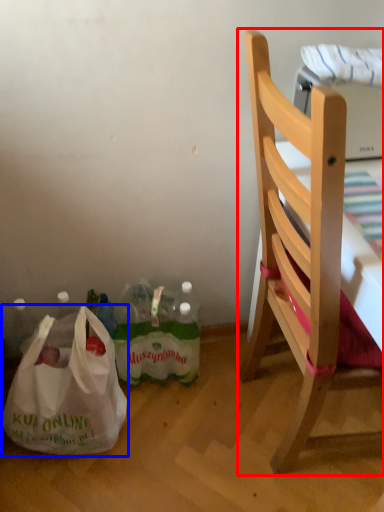
Question: Which point is closer to the camera, chair (highlighted by a red box) or plastic bag (highlighted by a blue box)?

Choices:
 (A) chair
 (B) plastic bag

Answer: (A)